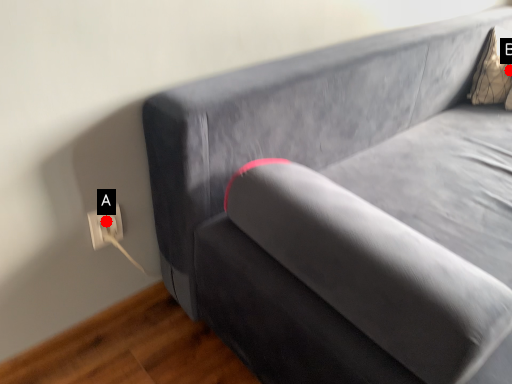
Question: Two points are circled on the image, labeled by A and B beside each circle. Which point is farther to the camera?

Choices:
 (A) A is further
 (B) B is further

Answer: (B)